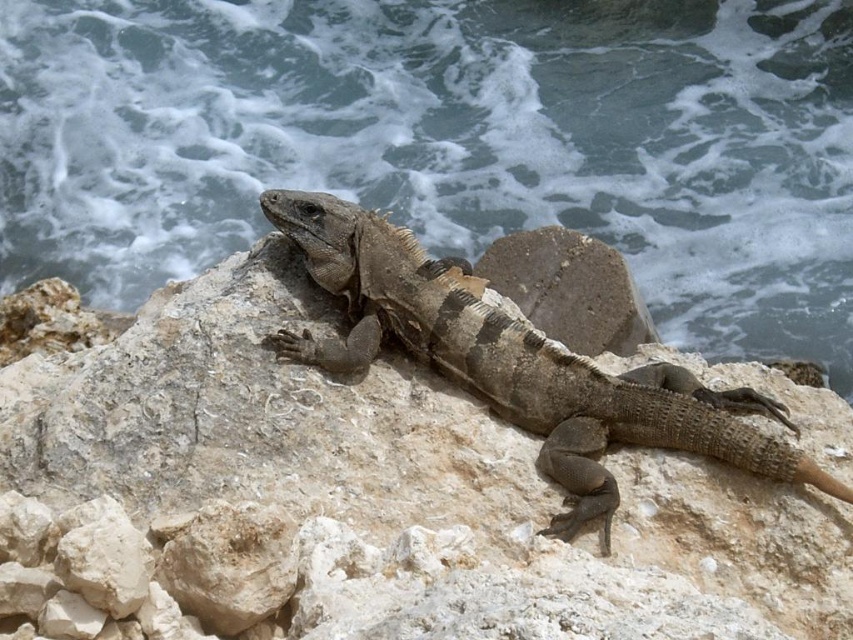
Is blue-green water at upper center below brown scaly lizard at center?

No.

Does blue-green water at upper center have a smaller size compared to brown scaly lizard at center?

No, blue-green water at upper center is not smaller than brown scaly lizard at center.

This screenshot has height=640, width=853. In order to click on blue-green water at upper center in this screenshot , I will do `click(447, 141)`.